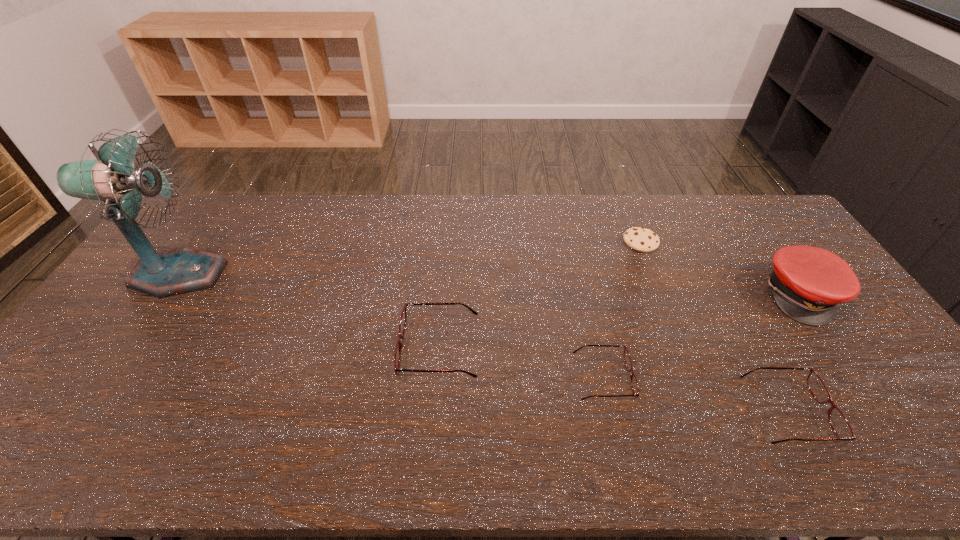
Image resolution: width=960 pixels, height=540 pixels. Find the location of `unoccupied position between the leftmost spectacles and the third object from right to left`. unoccupied position between the leftmost spectacles and the third object from right to left is located at coordinates (540, 295).

The image size is (960, 540). What are the coordinates of `free space between the leftmost object and the tallest spectacles` in the screenshot? It's located at (309, 311).

This screenshot has width=960, height=540. I want to click on vacant area that lies between the third tallest object and the tallest object, so click(x=309, y=311).

The width and height of the screenshot is (960, 540). I want to click on free space between the fourth object from left to right and the shortest spectacles, so click(622, 310).

This screenshot has width=960, height=540. I want to click on free space between the second spectacles from left to right and the fourth object from left to right, so click(x=622, y=310).

Locate an element on the screen. The height and width of the screenshot is (540, 960). blank region between the shortest spectacles and the rightmost object is located at coordinates (703, 336).

You are a GUI agent. You are given a task and a screenshot of the screen. Output one action in this format:
    pyautogui.click(x=<x>, y=<y>)
    Task: Click on the vacant area that lies between the second shortest spectacles and the fourth object from right to left
    The image size is (960, 540).
    Given the screenshot: What is the action you would take?
    pyautogui.click(x=696, y=395)

Where is `object that ranks as the fourth closest to the shortest spectacles`? object that ranks as the fourth closest to the shortest spectacles is located at coordinates (807, 283).

Locate which object ranks fourth in proximity to the second tallest spectacles. Please provide its 2D coordinates. Your answer should be formatted as a tuple, i.e. [(x, y)], where the tuple contains the x and y coordinates of a point satisfying the conditions above.

[(403, 318)]

Identify which spectacles is the nearest to the second spectacles from left to right. Please provide its 2D coordinates. Your answer should be formatted as a tuple, i.e. [(x, y)], where the tuple contains the x and y coordinates of a point satisfying the conditions above.

[(403, 318)]